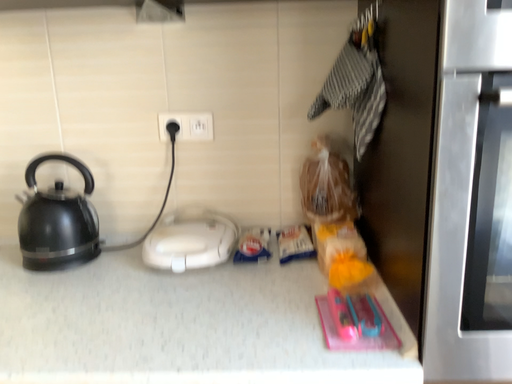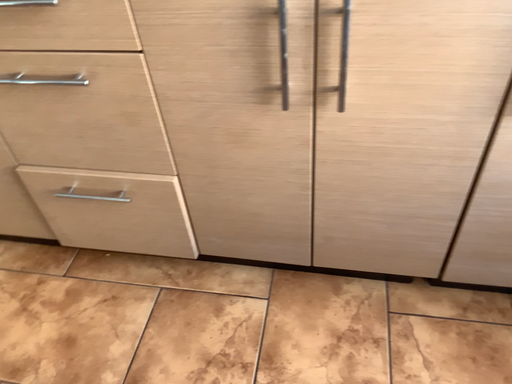
Question: How did the camera likely rotate when shooting the video?

Choices:
 (A) rotated right
 (B) rotated left

Answer: (B)